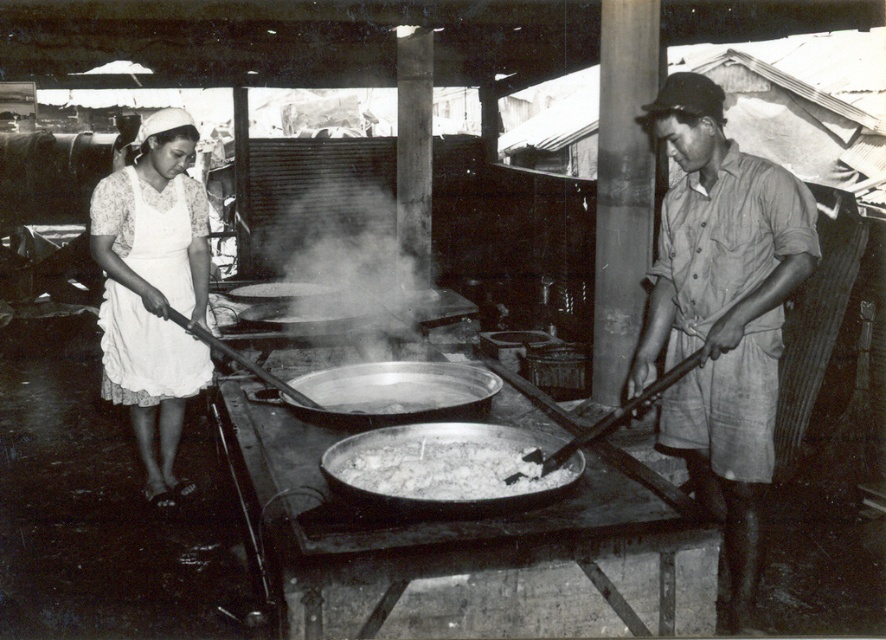
Question: Is white apron at left to the right of shiny metal wok at center from the viewer's perspective?

Choices:
 (A) no
 (B) yes

Answer: (A)

Question: Estimate the real-world distances between objects in this image. Which object is farther from the shiny metal wok at center?

Choices:
 (A) white apron at left
 (B) matte khaki shirt at right
 (C) white fluffy rice at center

Answer: (B)

Question: Which object is the closest to the matte khaki shirt at right?

Choices:
 (A) white fluffy rice at center
 (B) shiny metal wok at center
 (C) white apron at left

Answer: (A)

Question: Which point is closer to the camera?

Choices:
 (A) shiny metal wok at center
 (B) white fluffy rice at center
 (C) matte khaki shirt at right

Answer: (B)

Question: Does white apron at left appear under white fluffy rice at center?

Choices:
 (A) yes
 (B) no

Answer: (B)

Question: Can you confirm if white apron at left is positioned below shiny metal wok at center?

Choices:
 (A) yes
 (B) no

Answer: (B)